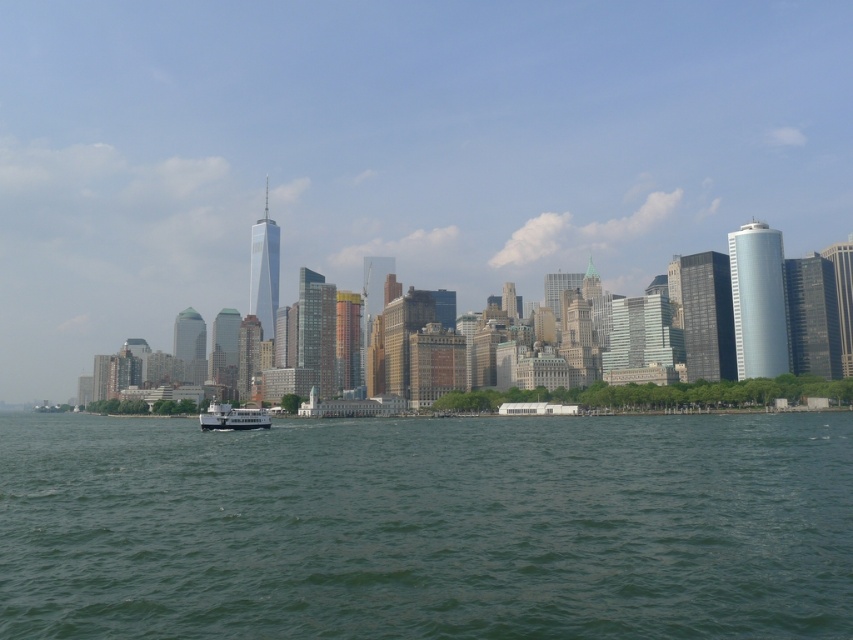
You are a photographer planning to capture the city skyline reflected in the green water at center. However, the white glossy ferry at center is blocking the reflection. Can you adjust your position to avoid the ferry while still seeing the skyline?

The green water at center is located above the white glossy ferry at center, so you can lower your camera angle to focus on the reflection in the green water at center below the ferry.

You are a photographer trying to capture the skyline in the background. You notice the green water at center and the white glossy ferry at center. Which object is closer to the camera, and why?

The white glossy ferry at center is closer to the camera because it appears taller than the green water at center, which is shorter in comparison.

You are a photographer trying to capture the skyline in the background through the reflection on the green water at center. However, the white glossy ferry at center is blocking your view. Which direction should you move your camera to avoid the ferry while keeping the skyline in frame?

You should move your camera to the left side of the white glossy ferry at center since the green water at center is positioned on the right side of it, allowing you to capture the skyline reflection without obstruction.